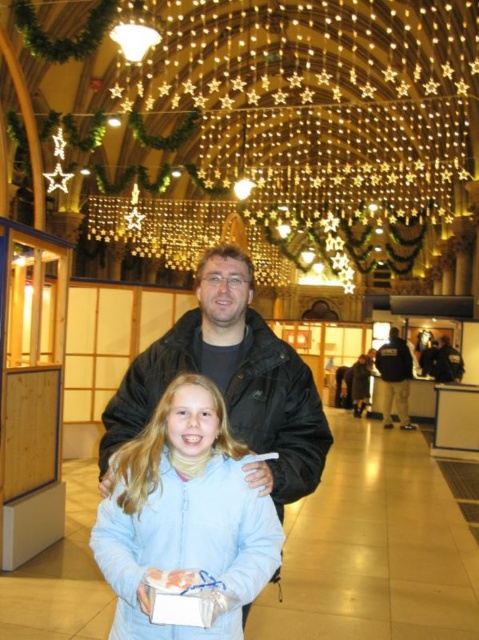
From the picture: You are standing in the festive indoor setting described. You see a point marked at coordinates (184, 515). What is located at this point?

The point at (184, 515) marks the location of the light blue fabric at center.

You are organizing a gift wrapping station and need to determine which item is wider between the light blue fabric at center and the dark blue jacket at center. Which one is wider?

The light blue fabric at center is wider than the dark blue jacket at center according to the description.

You are standing in the festive shopping arcade and see two points marked in the image. Which point is closer to you, point (203, 426) or point (385, 410)?

Point (203, 426) is in front of point (385, 410), so it is closer to you.